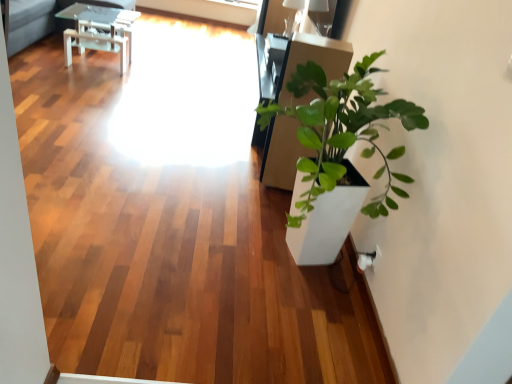
Question: From the image's perspective, is white glossy table at upper left under translucent glass window screen at upper center?

Choices:
 (A) no
 (B) yes

Answer: (B)

Question: From the image's perspective, is white glossy table at upper left above translucent glass window screen at upper center?

Choices:
 (A) yes
 (B) no

Answer: (B)

Question: Considering the relative sizes of white glossy table at upper left and translucent glass window screen at upper center in the image provided, is white glossy table at upper left bigger than translucent glass window screen at upper center?

Choices:
 (A) no
 (B) yes

Answer: (B)

Question: Does white glossy table at upper left have a lesser width compared to translucent glass window screen at upper center?

Choices:
 (A) no
 (B) yes

Answer: (A)

Question: Considering the relative sizes of white glossy table at upper left and translucent glass window screen at upper center in the image provided, is white glossy table at upper left taller than translucent glass window screen at upper center?

Choices:
 (A) no
 (B) yes

Answer: (B)

Question: Is white glossy table at upper left smaller than translucent glass window screen at upper center?

Choices:
 (A) no
 (B) yes

Answer: (A)

Question: Is translucent glass window screen at upper center outside white glossy table at upper left?

Choices:
 (A) yes
 (B) no

Answer: (A)

Question: Does translucent glass window screen at upper center have a greater width compared to white glossy table at upper left?

Choices:
 (A) yes
 (B) no

Answer: (B)

Question: Can you confirm if translucent glass window screen at upper center is positioned to the left of white glossy table at upper left?

Choices:
 (A) no
 (B) yes

Answer: (A)

Question: Is translucent glass window screen at upper center looking in the opposite direction of white glossy table at upper left?

Choices:
 (A) no
 (B) yes

Answer: (A)

Question: Would you consider translucent glass window screen at upper center to be distant from white glossy table at upper left?

Choices:
 (A) no
 (B) yes

Answer: (B)

Question: From a real-world perspective, is translucent glass window screen at upper center physically above white glossy table at upper left?

Choices:
 (A) yes
 (B) no

Answer: (B)

Question: From the image's perspective, is white glossy table at upper left located above or below translucent glass window screen at upper center?

Choices:
 (A) above
 (B) below

Answer: (B)